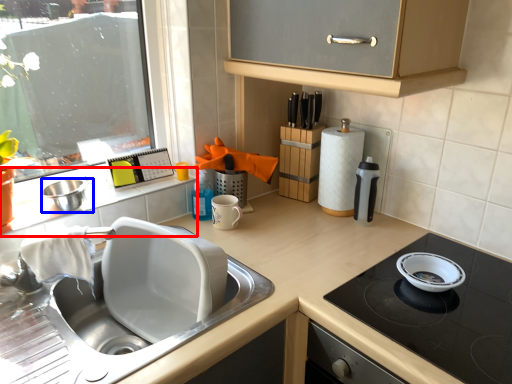
Question: Among these objects, which one is farthest to the camera, window sill (highlighted by a red box) or mixing bowl (highlighted by a blue box)?

Choices:
 (A) window sill
 (B) mixing bowl

Answer: (B)